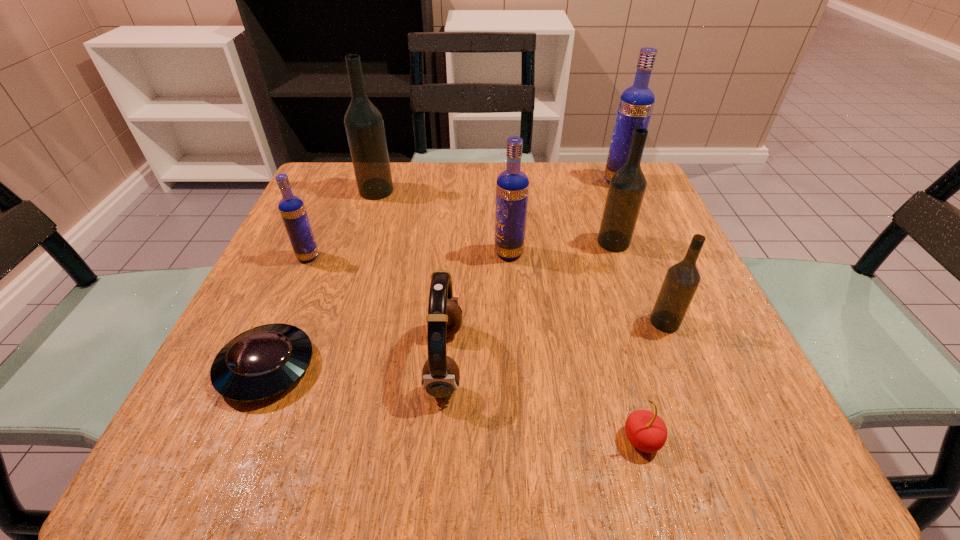
You are a GUI agent. You are given a task and a screenshot of the screen. Output one action in this format:
    pyautogui.click(x=<x>, y=<y>)
    Task: Click on the vacant area located on the left of the second smallest black vodka
    The image size is (960, 540).
    Given the screenshot: What is the action you would take?
    pyautogui.click(x=426, y=242)

Where is `free point located on the front of the leftmost vodka`? This screenshot has height=540, width=960. free point located on the front of the leftmost vodka is located at coordinates (252, 384).

Find the location of a particular element. Image resolution: width=960 pixels, height=540 pixels. vacant space located on the left of the smallest black vodka is located at coordinates [x=567, y=322].

Identify the location of vacant area located 0.340m on the ear cup of the headset. The width and height of the screenshot is (960, 540). (681, 361).

Identify the location of free space located on the left of the red cherry. This screenshot has width=960, height=540. (339, 440).

The width and height of the screenshot is (960, 540). Find the location of `vacant space located on the back of the gray saucer`. vacant space located on the back of the gray saucer is located at coordinates (322, 239).

The height and width of the screenshot is (540, 960). Find the location of `headset that is at the near edge`. headset that is at the near edge is located at coordinates (440, 376).

Locate an element on the screen. This screenshot has width=960, height=540. cherry at the near edge is located at coordinates (646, 431).

The image size is (960, 540). What are the coordinates of `saucer situated at the near edge` in the screenshot? It's located at click(x=258, y=364).

The width and height of the screenshot is (960, 540). Identify the location of saucer that is at the left edge. (258, 364).